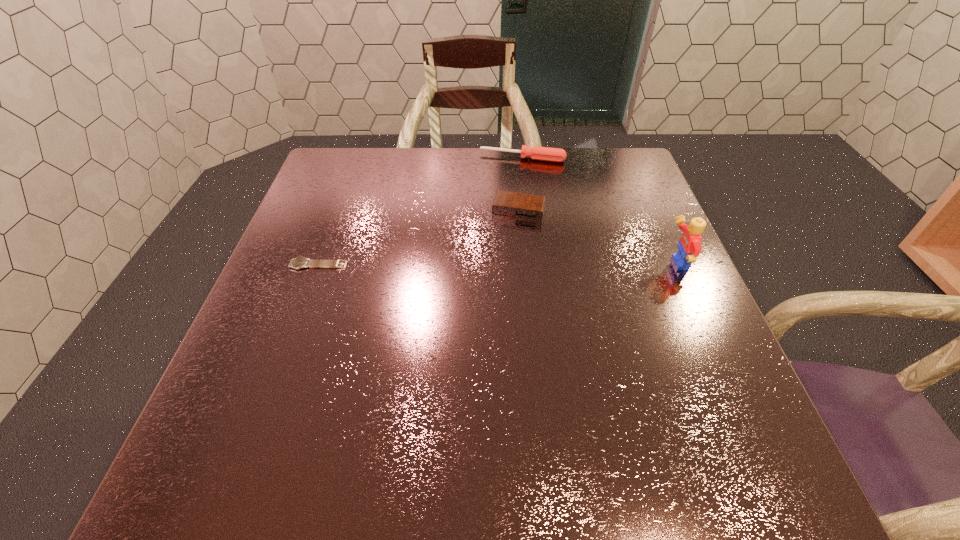
Image resolution: width=960 pixels, height=540 pixels. Find the location of `vacant space that's between the second farthest object and the screwdriver`. vacant space that's between the second farthest object and the screwdriver is located at coordinates (520, 184).

I want to click on vacant area that lies between the Lego and the screwdriver, so pyautogui.click(x=599, y=211).

The width and height of the screenshot is (960, 540). What are the coordinates of `free area in between the leftmost object and the alarm clock` in the screenshot? It's located at (419, 238).

At what (x,y) coordinates should I click in order to perform the action: click on empty space between the third nearest object and the watch. Please return your answer as a coordinate pair (x, y). Image resolution: width=960 pixels, height=540 pixels. Looking at the image, I should click on (419, 238).

I want to click on free spot between the leftmost object and the third nearest object, so click(419, 238).

This screenshot has width=960, height=540. In order to click on free space between the alarm clock and the shortest object in this screenshot , I will do `click(419, 238)`.

You are a GUI agent. You are given a task and a screenshot of the screen. Output one action in this format:
    pyautogui.click(x=<x>, y=<y>)
    Task: Click on the object that stands as the second closest to the shortest object
    The height and width of the screenshot is (540, 960).
    Given the screenshot: What is the action you would take?
    pyautogui.click(x=535, y=153)

I want to click on object that stands as the second closest to the third nearest object, so click(x=689, y=247).

The width and height of the screenshot is (960, 540). Find the location of `free point that satisfies the following two spatial constraints: 1. on the back side of the second farthest object; 2. on the right side of the watch`. free point that satisfies the following two spatial constraints: 1. on the back side of the second farthest object; 2. on the right side of the watch is located at coordinates (338, 211).

Where is `vacant space that satisfies the following two spatial constraints: 1. on the front side of the Lego; 2. on the face of the screwdriver`? This screenshot has width=960, height=540. vacant space that satisfies the following two spatial constraints: 1. on the front side of the Lego; 2. on the face of the screwdriver is located at coordinates (536, 264).